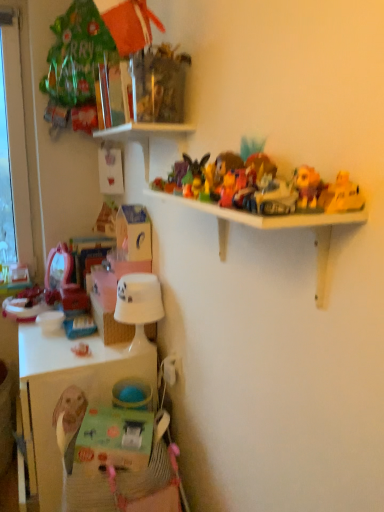
Question: Is plush yellow bear at upper right, the 2th toy positioned from the bottom, further to camera compared to white plastic shelf at upper center?

Choices:
 (A) yes
 (B) no

Answer: (A)

Question: From a real-world perspective, is plush yellow bear at upper right, marked as the 1th toy in a top-to-bottom arrangement, located beneath white plastic shelf at upper center?

Choices:
 (A) yes
 (B) no

Answer: (B)

Question: Is plush yellow bear at upper right, marked as the 1th toy in a front-to-back arrangement, positioned beyond the bounds of white plastic shelf at upper center?

Choices:
 (A) yes
 (B) no

Answer: (A)

Question: Is plush yellow bear at upper right, the 2th toy positioned from the bottom, facing away from white plastic shelf at upper center?

Choices:
 (A) yes
 (B) no

Answer: (B)

Question: Is plush yellow bear at upper right, the 2th toy viewed from the left, wider than white plastic shelf at upper center?

Choices:
 (A) yes
 (B) no

Answer: (B)

Question: Which is correct: white plastic shelf at upper center is inside matte pink toy at lower left, which is counted as the first toy, starting from the left, or outside of it?

Choices:
 (A) inside
 (B) outside

Answer: (B)

Question: Considering their positions, is white plastic shelf at upper center located in front of or behind matte pink toy at lower left, which is counted as the first toy, starting from the left?

Choices:
 (A) behind
 (B) front

Answer: (B)

Question: Does point (218, 238) appear closer or farther from the camera than point (82, 343)?

Choices:
 (A) farther
 (B) closer

Answer: (B)

Question: Considering the positions of white plastic shelf at upper center and matte pink toy at lower left, positioned as the second toy in front-to-back order, in the image, is white plastic shelf at upper center bigger or smaller than matte pink toy at lower left, positioned as the second toy in front-to-back order,?

Choices:
 (A) big
 (B) small

Answer: (A)

Question: From the image's perspective, relative to white plastic shelf at upper center, is matte pink toy at lower left, positioned as the 1th toy in bottom-to-top order, above or below?

Choices:
 (A) above
 (B) below

Answer: (B)

Question: Is matte pink toy at lower left, positioned as the 1th toy in bottom-to-top order, bigger or smaller than white plastic shelf at upper center?

Choices:
 (A) small
 (B) big

Answer: (A)

Question: Is matte pink toy at lower left, which is counted as the first toy, starting from the left, taller or shorter than white plastic shelf at upper center?

Choices:
 (A) short
 (B) tall

Answer: (A)

Question: From a real-world perspective, is matte pink toy at lower left, positioned as the 1th toy in bottom-to-top order, physically located above or below white plastic shelf at upper center?

Choices:
 (A) below
 (B) above

Answer: (A)

Question: From the image's perspective, is woven straw basket at lower center above or below white plastic shelf at upper center?

Choices:
 (A) below
 (B) above

Answer: (A)

Question: From a real-world perspective, is woven straw basket at lower center positioned above or below white plastic shelf at upper center?

Choices:
 (A) above
 (B) below

Answer: (B)